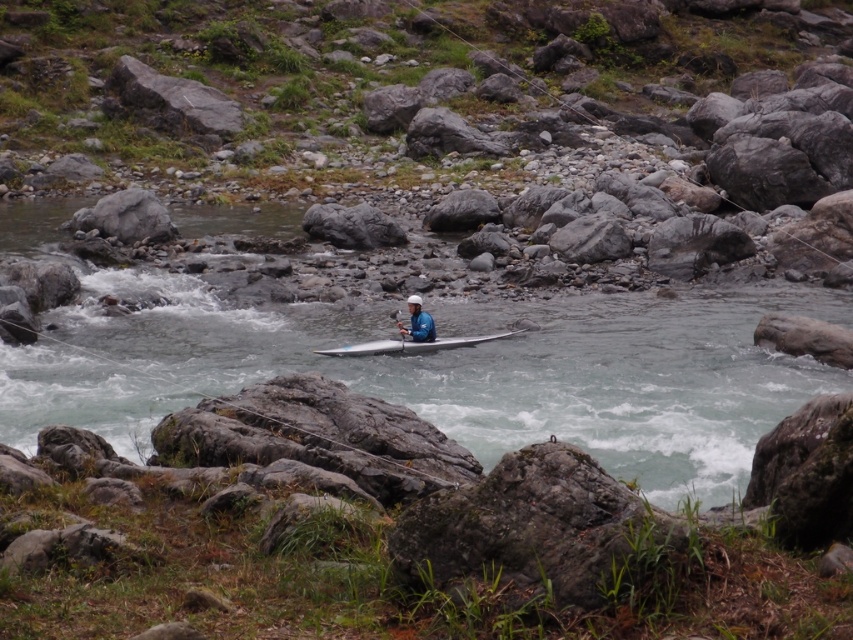
Question: Is blue fabric helmet at center bigger than white plastic paddle at center?

Choices:
 (A) yes
 (B) no

Answer: (A)

Question: From the image, what is the correct spatial relationship of white plastic kayak at center in relation to white plastic paddle at center?

Choices:
 (A) above
 (B) below

Answer: (B)

Question: Which of the following is the farthest from the observer?

Choices:
 (A) white plastic kayak at center
 (B) blue fabric helmet at center

Answer: (A)

Question: Which point is closer to the camera taking this photo?

Choices:
 (A) (426, 324)
 (B) (398, 317)

Answer: (B)

Question: Can you confirm if white plastic kayak at center is positioned above white plastic paddle at center?

Choices:
 (A) yes
 (B) no

Answer: (B)

Question: Which point is farther from the camera taking this photo?

Choices:
 (A) (387, 348)
 (B) (398, 310)

Answer: (B)